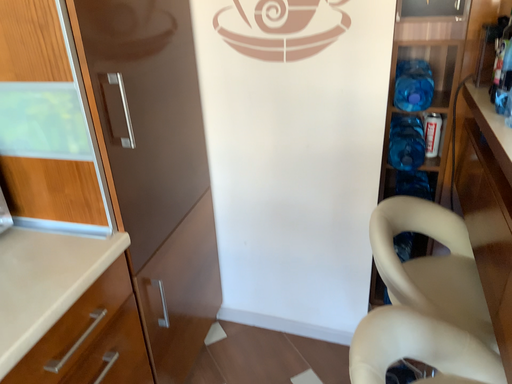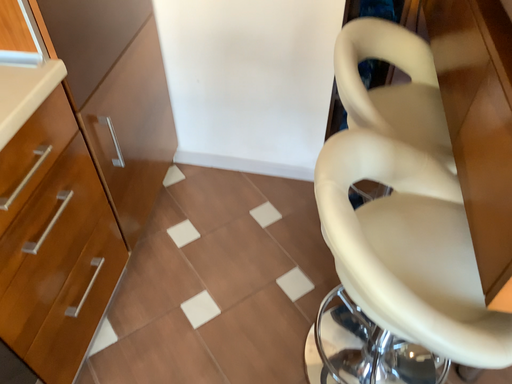
Question: Which way did the camera rotate in the video?

Choices:
 (A) rotated left
 (B) rotated right

Answer: (B)